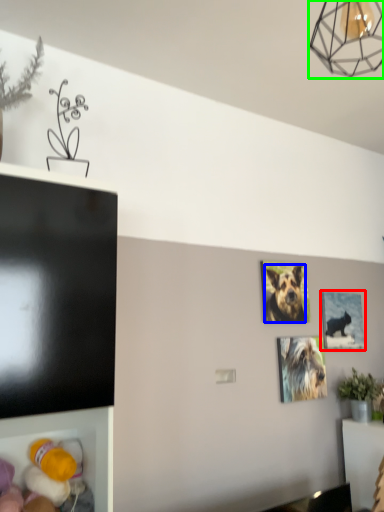
Question: Which is farther away from picture frame (highlighted by a red box)? dog (highlighted by a blue box) or lamp (highlighted by a green box)?

Choices:
 (A) dog
 (B) lamp

Answer: (B)